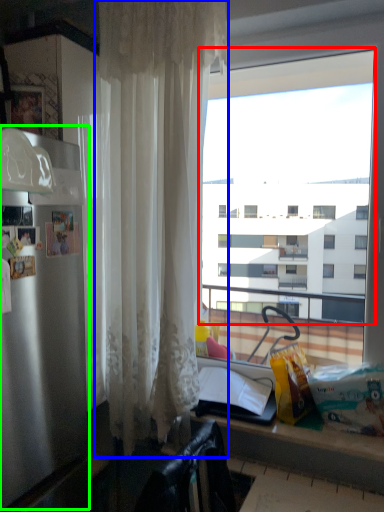
Question: Estimate the real-world distances between objects in this image. Which object is farther from window (highlighted by a red box), curtain (highlighted by a blue box) or appliance (highlighted by a green box)?

Choices:
 (A) curtain
 (B) appliance

Answer: (B)